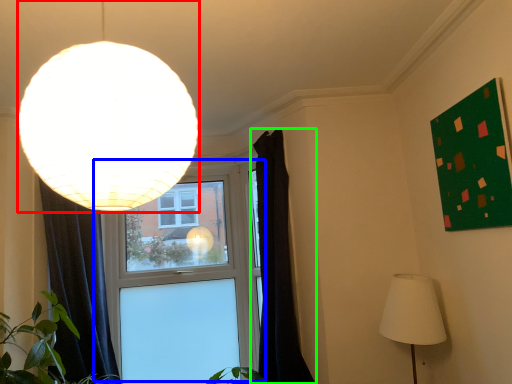
Question: Which object is positioned closest to lamp (highlighted by a red box)? Select from window (highlighted by a blue box) and curtain (highlighted by a green box).

Choices:
 (A) window
 (B) curtain

Answer: (B)